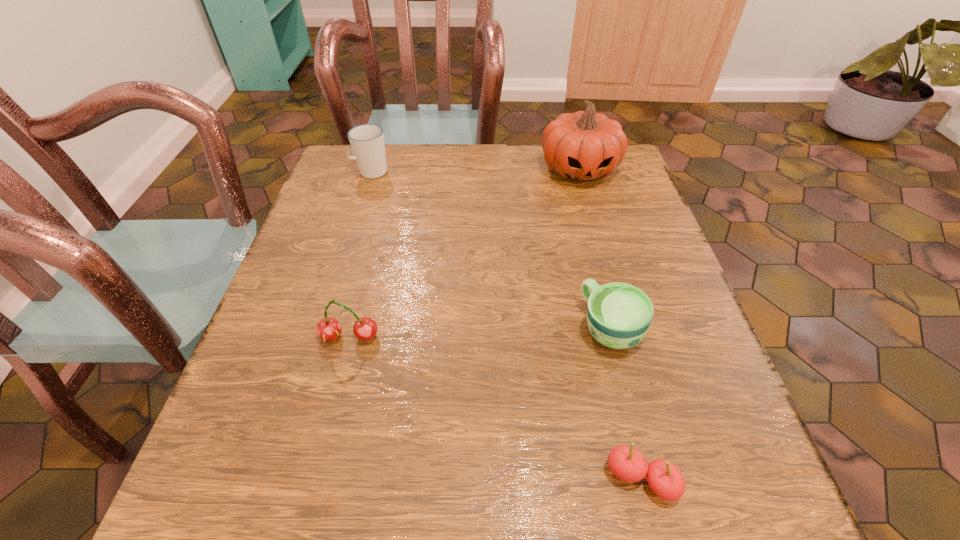
Locate an element on the screen. vacant region between the pumpkin and the left cherry is located at coordinates (465, 253).

You are a GUI agent. You are given a task and a screenshot of the screen. Output one action in this format:
    pyautogui.click(x=<x>, y=<y>)
    Task: Click on the vacant point located between the taller cherry and the shorter cherry
    The width and height of the screenshot is (960, 540).
    Given the screenshot: What is the action you would take?
    pyautogui.click(x=495, y=409)

The width and height of the screenshot is (960, 540). I want to click on the closest object to the farther cherry, so click(x=619, y=315).

What are the coordinates of `the fourth closest object relative to the nearer cup` in the screenshot? It's located at (367, 141).

You are a GUI agent. You are given a task and a screenshot of the screen. Output one action in this format:
    pyautogui.click(x=<x>, y=<y>)
    Task: Click on the free space that satisfies the following two spatial constraints: 1. with a handle on the side of the right cup; 2. on the right side of the left cup
    The width and height of the screenshot is (960, 540).
    Given the screenshot: What is the action you would take?
    pyautogui.click(x=322, y=328)

At what (x,y) coordinates should I click in order to perform the action: click on free spot that satisfies the following two spatial constraints: 1. with stems pointing upwards on the taller cherry; 2. on the left side of the shorter cherry. Please return your answer as a coordinate pair (x, y). The image size is (960, 540). Looking at the image, I should click on (314, 480).

You are a GUI agent. You are given a task and a screenshot of the screen. Output one action in this format:
    pyautogui.click(x=<x>, y=<y>)
    Task: Click on the vacant space that satisfies the following two spatial constraints: 1. with a handle on the side of the farther cup; 2. on the left side of the nearer cup
    The width and height of the screenshot is (960, 540).
    Given the screenshot: What is the action you would take?
    pyautogui.click(x=322, y=328)

Where is `free space that satisfies the following two spatial constraints: 1. with a handle on the side of the shorter cup; 2. on the left side of the taller cup`? The height and width of the screenshot is (540, 960). free space that satisfies the following two spatial constraints: 1. with a handle on the side of the shorter cup; 2. on the left side of the taller cup is located at coordinates (322, 328).

Locate an element on the screen. This screenshot has height=540, width=960. free point that satisfies the following two spatial constraints: 1. on the face of the tallest object; 2. with a handle on the side of the taller cup is located at coordinates (580, 172).

Identify the location of blank space that satisfies the following two spatial constraints: 1. with stems pointing upwards on the shorter cherry; 2. on the left side of the taller cherry. The image size is (960, 540). (314, 480).